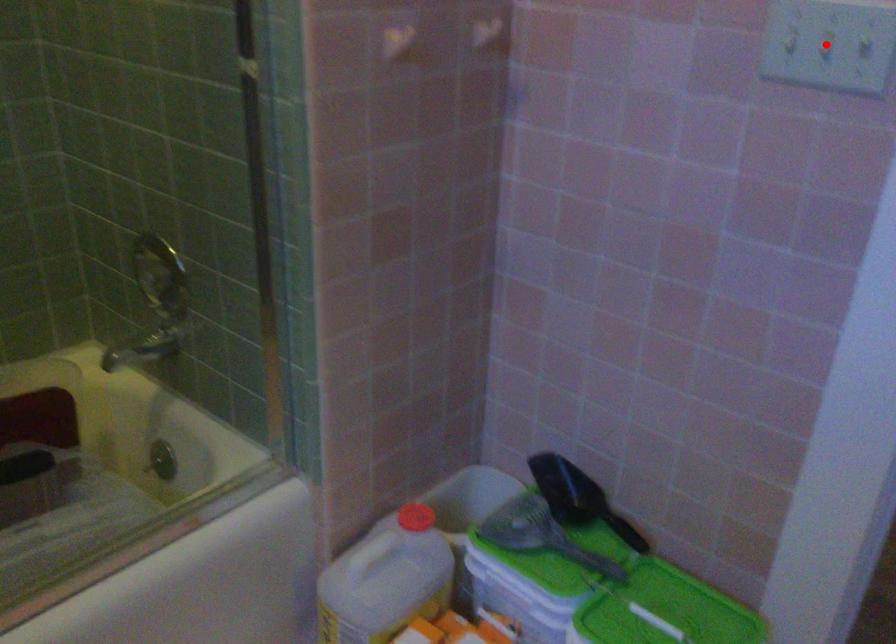
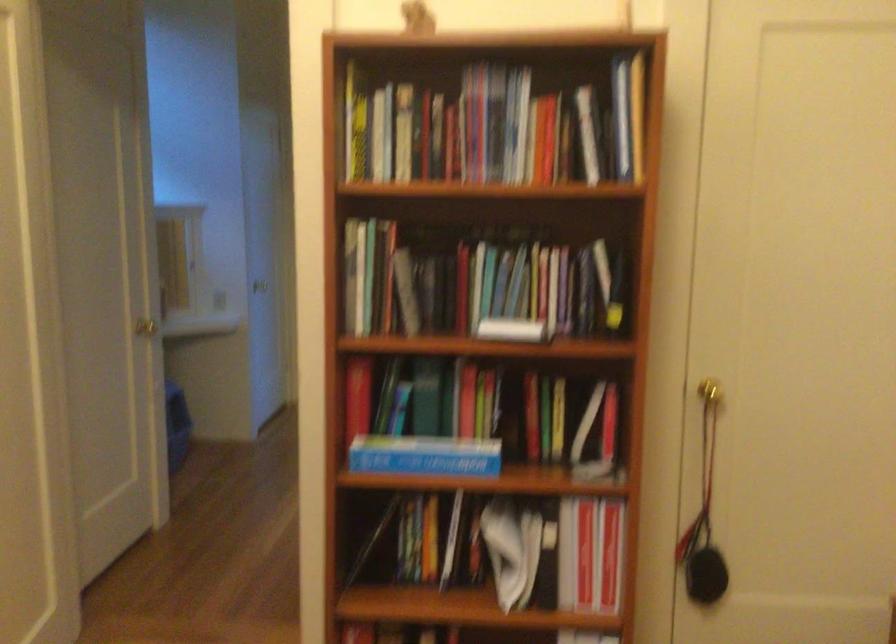
Question: I am providing you with two images of the same scene from different viewpoints. A red point is marked on the first image. Can you still see the location of the red point in image 2?

Choices:
 (A) Yes
 (B) No

Answer: (B)